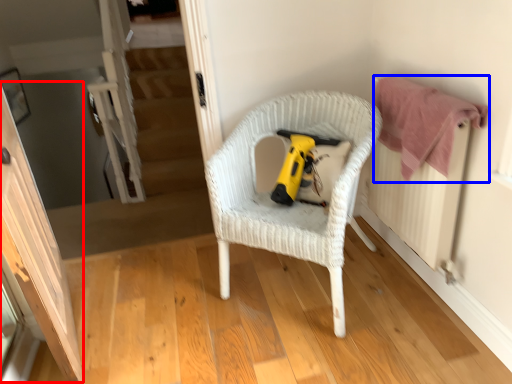
Question: Which point is closer to the camera, screen door (highlighted by a red box) or clothe (highlighted by a blue box)?

Choices:
 (A) screen door
 (B) clothe

Answer: (A)